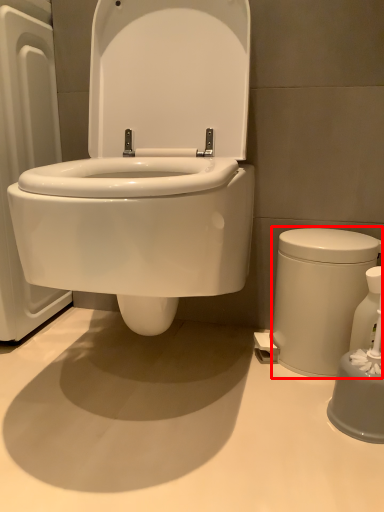
Question: From the image, what is the correct spatial relationship of porcelain (annotated by the red box) in relation to soap dispenser?

Choices:
 (A) right
 (B) left

Answer: (B)